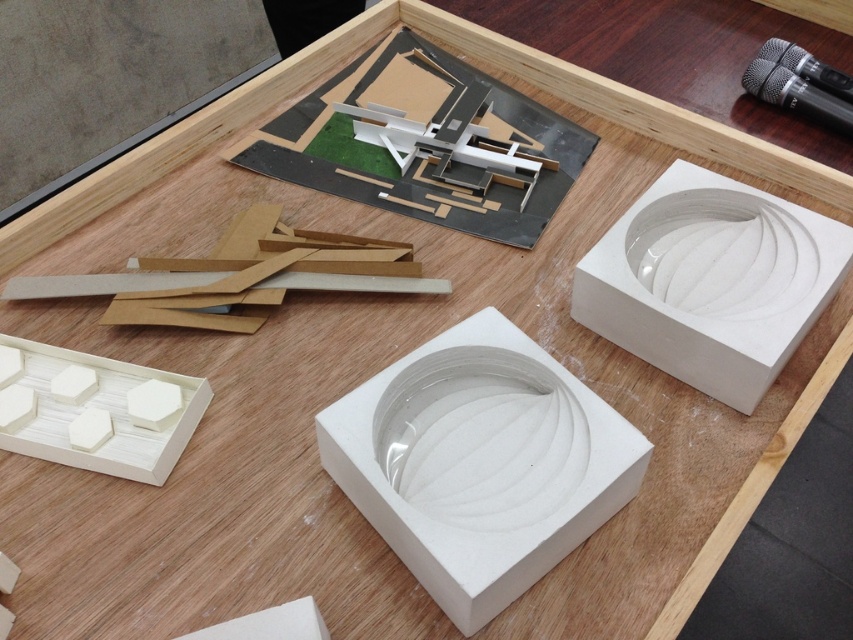
Question: Which point is closer to the camera?

Choices:
 (A) (778, 234)
 (B) (190, 404)
 (C) (415, 547)

Answer: (C)

Question: Which object is positioned closest to the white matte hexagon at lower left?

Choices:
 (A) white matte box at center
 (B) white matte box at center-right

Answer: (A)

Question: Is white matte box at center-right behind white matte hexagon at lower left?

Choices:
 (A) no
 (B) yes

Answer: (A)

Question: Which object is closer to the camera taking this photo?

Choices:
 (A) white matte box at center-right
 (B) white matte hexagon at lower left
 (C) white matte box at center

Answer: (C)

Question: Does white matte box at center appear on the right side of white matte hexagon at lower left?

Choices:
 (A) no
 (B) yes

Answer: (B)

Question: Is white matte box at center bigger than white matte box at center-right?

Choices:
 (A) no
 (B) yes

Answer: (A)